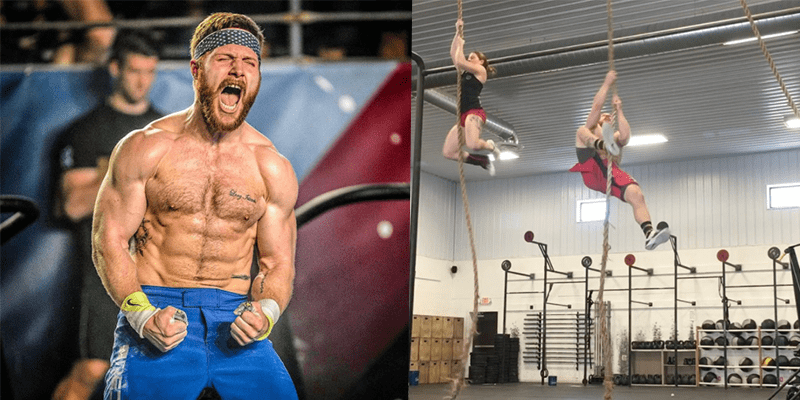
Identify the location of windows in gym. (590, 208), (798, 193).